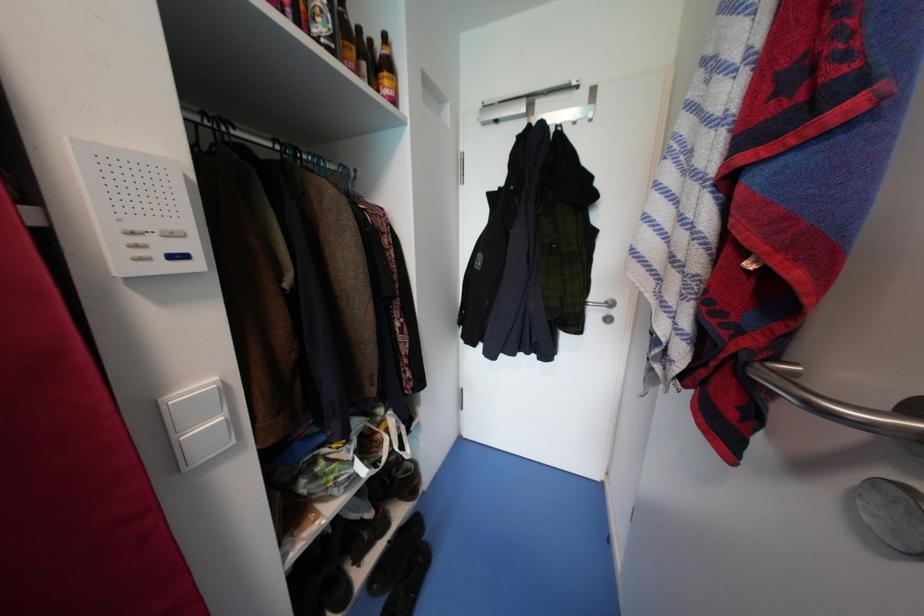
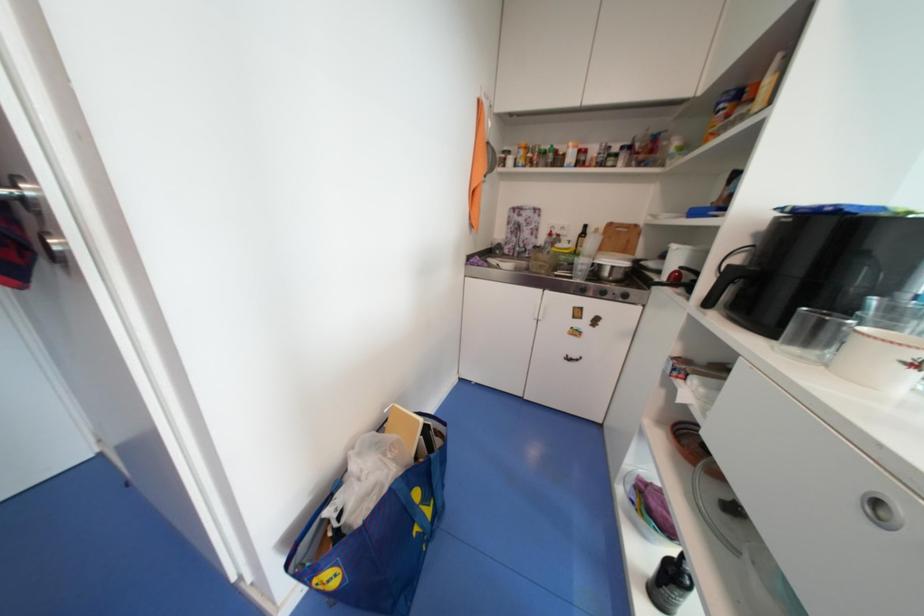
The images are taken continuously from a first-person perspective. In which direction is your viewpoint rotating?

The camera's rotation is toward right-down.